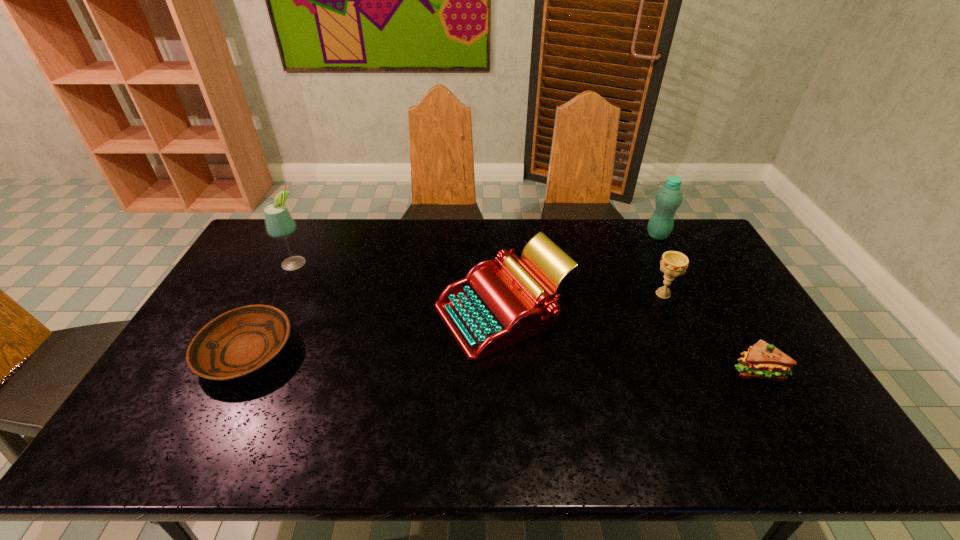
Image resolution: width=960 pixels, height=540 pixels. I want to click on vacant region that satisfies the following two spatial constraints: 1. on the typing side of the sandwich; 2. on the left side of the third object from left to right, so click(x=505, y=370).

The image size is (960, 540). Find the location of `vacant area in the image that satisfies the following two spatial constraints: 1. on the front side of the second shortest object; 2. on the right side of the plate`. vacant area in the image that satisfies the following two spatial constraints: 1. on the front side of the second shortest object; 2. on the right side of the plate is located at coordinates (237, 370).